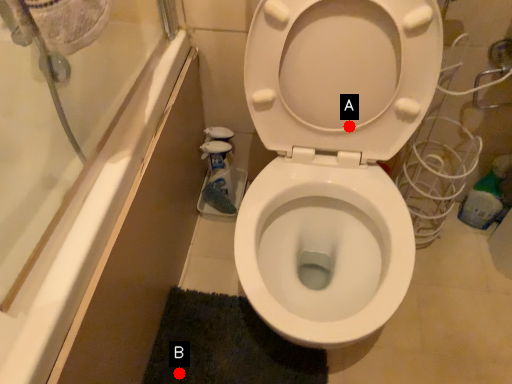
Question: Two points are circled on the image, labeled by A and B beside each circle. Which point is farther to the camera?

Choices:
 (A) A is further
 (B) B is further

Answer: (B)